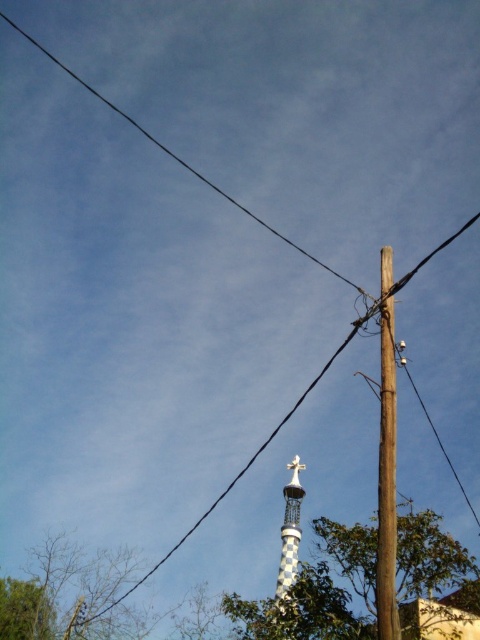
Question: Estimate the real-world distances between objects in this image. Which object is closer to the checkerboard-patterned tower at center?

Choices:
 (A) brown leafless tree at lower left
 (B) green leafy tree at center

Answer: (B)

Question: Can you confirm if green leafy tree at center is positioned to the left of checkerboard-patterned tower at center?

Choices:
 (A) yes
 (B) no

Answer: (B)

Question: Is green leafy tree at center to the right of brown leafless tree at lower left from the viewer's perspective?

Choices:
 (A) yes
 (B) no

Answer: (A)

Question: Does brown leafless tree at lower left have a smaller size compared to checkerboard-patterned tower at center?

Choices:
 (A) yes
 (B) no

Answer: (A)

Question: Which of these objects is positioned farthest from the checkerboard-patterned tower at center?

Choices:
 (A) brown leafless tree at lower left
 (B) green leafy tree at center

Answer: (A)

Question: Which object is positioned farthest from the green leafy tree at center?

Choices:
 (A) checkerboard-patterned tower at center
 (B) brown leafless tree at lower left

Answer: (B)